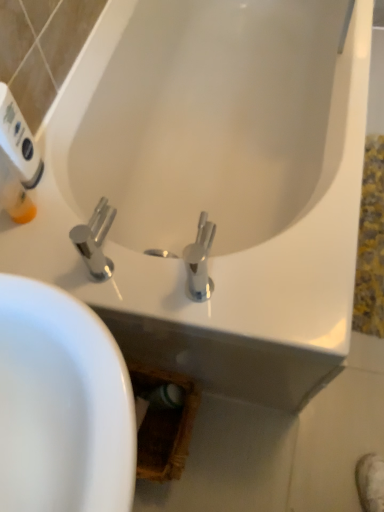
This screenshot has height=512, width=384. What are the coordinates of `vacant area that lies in front of white plastic hand dryer at upper left` in the screenshot? It's located at [x=50, y=241].